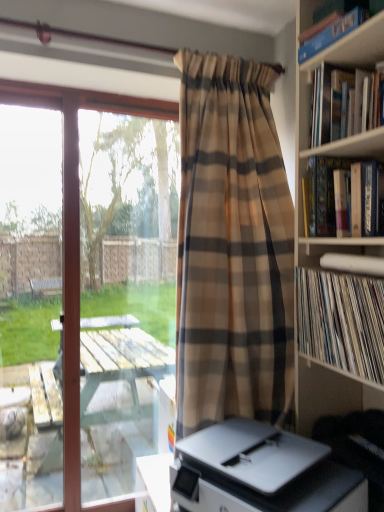
Question: Would you say white vinyl records at right, which is the first book in bottom-to-top order, is to the left or to the right of hardcover book at upper right, the second book positioned from the top, in the picture?

Choices:
 (A) right
 (B) left

Answer: (B)

Question: From a real-world perspective, relative to hardcover book at upper right, the second book positioned from the top, is white vinyl records at right, marked as the 4th book in a top-to-bottom arrangement, vertically above or below?

Choices:
 (A) above
 (B) below

Answer: (B)

Question: Which is farther from the hardcover book at upper right, acting as the 3th book starting from the bottom?

Choices:
 (A) white vinyl records at right, which is the first book in bottom-to-top order
 (B) transparent glass window at left
 (C) plaid fabric curtain at center
 (D) white plastic printer at lower center
 (E) blue hardcover book at upper right, which is counted as the fourth book, starting from the bottom

Answer: (D)

Question: Estimate the real-world distances between objects in this image. Which object is farther from the hardcover book at upper right, the second book positioned from the top?

Choices:
 (A) hardcover book at upper right, which ranks as the third book in top-to-bottom order
 (B) white vinyl records at right, marked as the 4th book in a top-to-bottom arrangement
 (C) blue hardcover book at upper right, which is counted as the fourth book, starting from the bottom
 (D) white plastic printer at lower center
 (E) transparent glass window at left

Answer: (D)